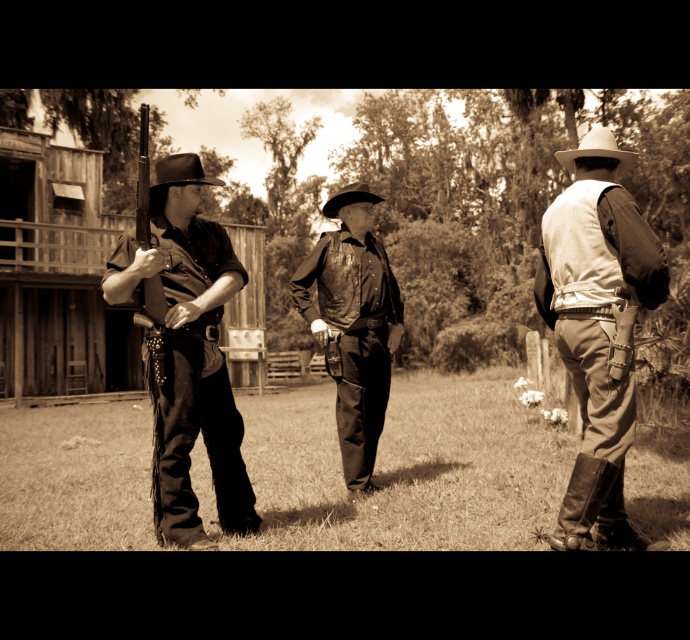
Who is positioned more to the right, leather vest at right or black felt cowboy hat at center?

From the viewer's perspective, leather vest at right appears more on the right side.

The image size is (690, 640). Describe the element at coordinates (598, 330) in the screenshot. I see `leather vest at right` at that location.

Between point (584, 481) and point (359, 189), which one is positioned behind?

Positioned behind is point (359, 189).

Locate an element on the screen. This screenshot has width=690, height=640. leather vest at right is located at coordinates (598, 330).

In the scene shown: Is matte black shirt at left to the left of black felt cowboy hat at left from the viewer's perspective?

Incorrect, matte black shirt at left is not on the left side of black felt cowboy hat at left.

Can you confirm if matte black shirt at left is wider than black felt cowboy hat at left?

In fact, matte black shirt at left might be narrower than black felt cowboy hat at left.

Does point (172, 486) lie behind point (172, 173)?

No.

Identify the location of matte black shirt at left. This screenshot has height=640, width=690. (187, 362).

Can you confirm if leather jacket at center is shorter than white matte cowboy hat at upper right?

No.

Identify the location of leather jacket at center. This screenshot has height=640, width=690. (353, 323).